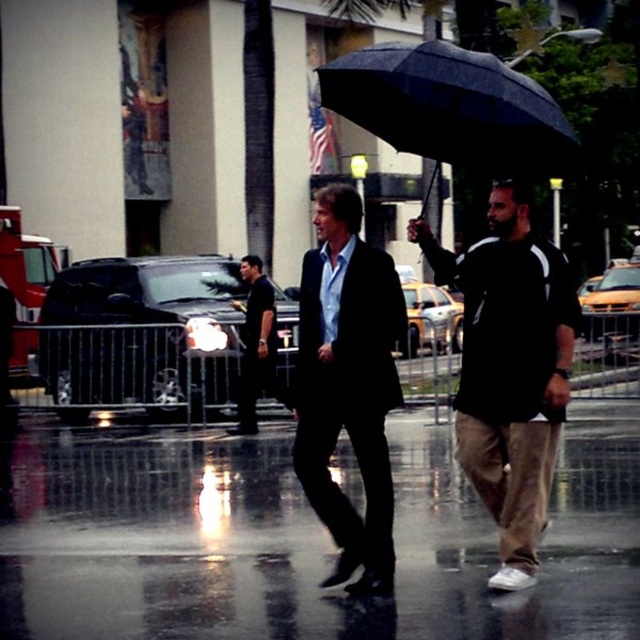
What are the coordinates of the black matte umbrella at right?

The black matte umbrella at right is located at point (509,371).

You are standing at the center of the image and want to locate the point with coordinates (509, 371). According to the scene, where would this point be located?

The point (509, 371) is located on the black matte umbrella at right.

You are a photographer trying to capture a clear shot of the matte black suit at center and the black matte umbrella at center in the rainy scene. Since the ground is wet and reflective, you want to avoid any reflections that might obstruct the view of these objects. Which object should you position closer to the camera to ensure its reflection is less prominent?

The matte black suit at center has a smaller size compared to black matte umbrella at center, so positioning the matte black suit at center closer to the camera would result in its smaller reflection being less prominent compared to the larger reflection of the umbrella.